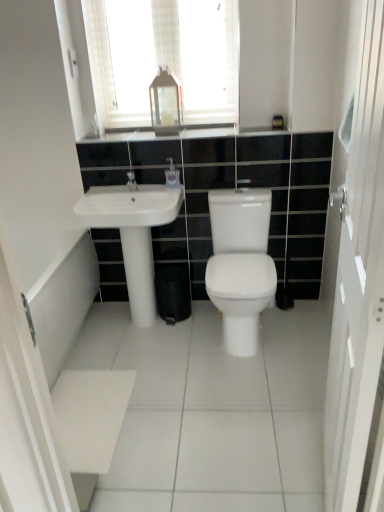
What is the approximate height of white glossy screen door at right?

The height of white glossy screen door at right is 1.57 meters.

What is the approximate width of white glossy screen door at right?

It is 3.96 inches.

This screenshot has height=512, width=384. Find the location of `white glossy pedestal at center`. white glossy pedestal at center is located at coordinates (139, 274).

In order to face white glossy pedestal at center, should I rotate leftwards or rightwards?

To align with it, rotate left about 7.343°.

Describe the element at coordinates (131, 181) in the screenshot. This screenshot has width=384, height=512. I see `matte silver faucet at center` at that location.

What do you see at coordinates (163, 57) in the screenshot?
I see `white textured mirror at upper center` at bounding box center [163, 57].

Looking at this image, what is the approximate height of white textured mirror at upper center?

white textured mirror at upper center is 28.94 inches in height.

Image resolution: width=384 pixels, height=512 pixels. Describe the element at coordinates (181, 133) in the screenshot. I see `white glossy countertop at upper center` at that location.

Find the location of a particular element. This screenshot has width=384, height=512. white glossy countertop at upper center is located at coordinates (181, 133).

Identify the location of white glossy sink at left. (129, 206).

This screenshot has width=384, height=512. Identify the location of white glossy soap dispenser at center. (172, 174).

In the image, is white glossy countertop at upper center positioned in front of or behind white glossy soap dispenser at center?

In the image, white glossy countertop at upper center appears in front of white glossy soap dispenser at center.

Considering the relative sizes of white glossy countertop at upper center and white glossy soap dispenser at center in the image provided, is white glossy countertop at upper center smaller than white glossy soap dispenser at center?

Actually, white glossy countertop at upper center might be larger than white glossy soap dispenser at center.

From the picture: From the image's perspective, does white glossy countertop at upper center appear higher than white glossy soap dispenser at center?

Yes, from the image's perspective, white glossy countertop at upper center is on top of white glossy soap dispenser at center.

Consider the image. Is white glossy pedestal at center at the left side of white glossy countertop at upper center?

Yes.

Is there a large distance between white glossy pedestal at center and white glossy countertop at upper center?

No, white glossy pedestal at center is not far from white glossy countertop at upper center.

Can white glossy countertop at upper center be found inside white glossy pedestal at center?

No, white glossy countertop at upper center is located outside of white glossy pedestal at center.

Considering the relative sizes of white glossy screen door at right and white glossy countertop at upper center in the image provided, is white glossy screen door at right shorter than white glossy countertop at upper center?

In fact, white glossy screen door at right may be taller than white glossy countertop at upper center.

Measure the distance from white glossy screen door at right to white glossy countertop at upper center.

white glossy screen door at right and white glossy countertop at upper center are 4.37 feet apart.

Which point is more forward, (353, 309) or (130, 140)?

The point (353, 309) is closer.

Is white glossy screen door at right closer to camera compared to white glossy countertop at upper center?

That is True.

From the image's perspective, is white glossy pedestal at center located above or below white glossy sink at left?

Based on their image positions, white glossy pedestal at center is located beneath white glossy sink at left.

Is white glossy pedestal at center facing towards white glossy sink at left?

No, white glossy pedestal at center does not turn towards white glossy sink at left.

Considering the positions of objects white glossy pedestal at center and white glossy sink at left in the image provided, who is behind, white glossy pedestal at center or white glossy sink at left?

white glossy pedestal at center is more distant.

Considering the relative sizes of white glossy pedestal at center and white glossy sink at left in the image provided, is white glossy pedestal at center thinner than white glossy sink at left?

Yes, white glossy pedestal at center is thinner than white glossy sink at left.

How far apart are white glossy soap dispenser at center and white glossy countertop at upper center?

They are 12.39 inches apart.

Does white glossy soap dispenser at center come in front of white glossy countertop at upper center?

No, white glossy soap dispenser at center is further to the viewer.

From a real-world perspective, is white glossy soap dispenser at center above or below white glossy countertop at upper center?

From a real-world perspective, white glossy soap dispenser at center is physically below white glossy countertop at upper center.

Does white glossy soap dispenser at center have a lesser height compared to white glossy countertop at upper center?

In fact, white glossy soap dispenser at center may be taller than white glossy countertop at upper center.

Considering the sizes of objects white glossy pedestal at center and transparent glass lantern at upper center in the image provided, who is thinner, white glossy pedestal at center or transparent glass lantern at upper center?

white glossy pedestal at center.

Is white glossy pedestal at center taller or shorter than transparent glass lantern at upper center?

white glossy pedestal at center is taller than transparent glass lantern at upper center.

Would you say transparent glass lantern at upper center is part of white glossy pedestal at center's contents?

No, transparent glass lantern at upper center is not a part of white glossy pedestal at center.

From a real-world perspective, does white glossy screen door at right sit lower than matte silver faucet at center?

Yes, from a real-world perspective, white glossy screen door at right is beneath matte silver faucet at center.

You are a GUI agent. You are given a task and a screenshot of the screen. Output one action in this format:
    pyautogui.click(x=<x>, y=<y>)
    Task: Click on the screen door located underneath the matte silver faucet at center (from a real-world perspective)
    
    Given the screenshot: What is the action you would take?
    pyautogui.click(x=358, y=279)

Is white glossy screen door at right positioned beyond the bounds of matte silver faucet at center?

Yes, white glossy screen door at right is located beyond the bounds of matte silver faucet at center.

In terms of width, does white glossy screen door at right look wider or thinner when compared to matte silver faucet at center?

white glossy screen door at right is thinner than matte silver faucet at center.

Where is `toiletry located behind the white glossy countertop at upper center`? toiletry located behind the white glossy countertop at upper center is located at coordinates pyautogui.click(x=172, y=174).

This screenshot has height=512, width=384. Find the location of `pillar that is on the left side of white glossy countertop at upper center`. pillar that is on the left side of white glossy countertop at upper center is located at coordinates (139, 274).

When comparing their distances from white glossy sink at left, does white glossy pedestal at center or transparent glass lantern at upper center seem further?

transparent glass lantern at upper center is positioned further to the anchor white glossy sink at left.

Which object lies further to the anchor point matte silver faucet at center, transparent glass lantern at upper center or white textured mirror at upper center?

white textured mirror at upper center is positioned further to the anchor matte silver faucet at center.

Looking at the image, which one is located closer to white glossy countertop at upper center, transparent glass lantern at upper center or white glossy pedestal at center?

Among the two, transparent glass lantern at upper center is located nearer to white glossy countertop at upper center.

Based on their spatial positions, is transparent glass lantern at upper center or matte silver faucet at center closer to white glossy countertop at upper center?

transparent glass lantern at upper center is closer to white glossy countertop at upper center.

Estimate the real-world distances between objects in this image. Which object is further from white glossy sink at left, white glossy screen door at right or white glossy countertop at upper center?

white glossy screen door at right.

Based on their spatial positions, is white glossy screen door at right or white glossy pedestal at center closer to white glossy soap dispenser at center?

Among the two, white glossy pedestal at center is located nearer to white glossy soap dispenser at center.

Consider the image. Based on their spatial positions, is white glossy soap dispenser at center or transparent glass lantern at upper center further from white glossy countertop at upper center?

The object further to white glossy countertop at upper center is white glossy soap dispenser at center.

Which object lies further to the anchor point transparent glass lantern at upper center, white glossy soap dispenser at center or white glossy pedestal at center?

white glossy pedestal at center is positioned further to the anchor transparent glass lantern at upper center.

I want to click on pillar located between white glossy screen door at right and white glossy countertop at upper center in the depth direction, so click(139, 274).

This screenshot has height=512, width=384. I want to click on counter top that lies between transparent glass lantern at upper center and matte silver faucet at center from top to bottom, so click(181, 133).

Find the location of a particular element. counter top that lies between white textured mirror at upper center and white glossy sink at left from top to bottom is located at coordinates (181, 133).

Locate an element on the screen. counter top located between white glossy screen door at right and transparent glass lantern at upper center in the depth direction is located at coordinates (181, 133).